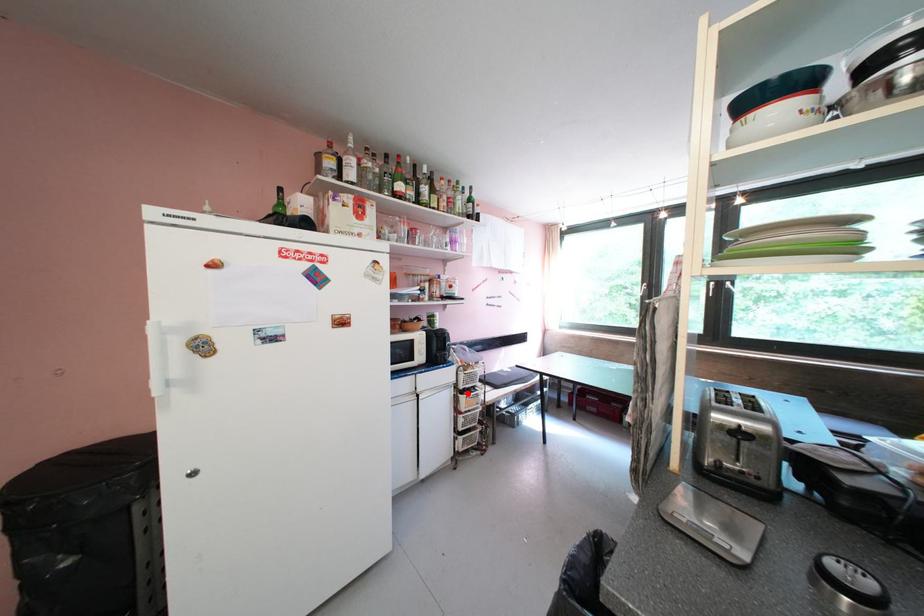
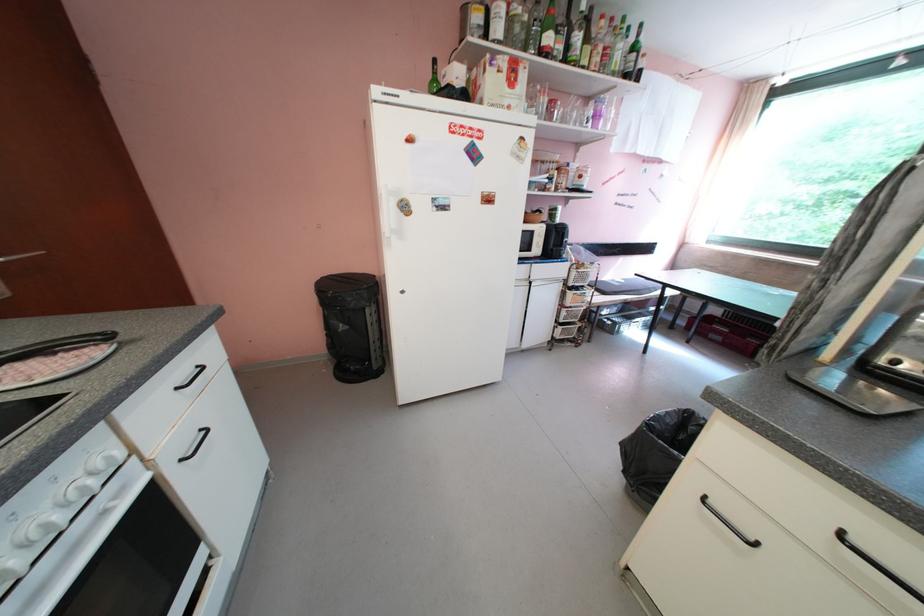
Question: I am providing you with two images of the same scene from different viewpoints. In image1, a red point is highlighted. Considering the same 3D point in image2, which of the following is correct?

Choices:
 (A) It is closer
 (B) It is farther

Answer: (A)